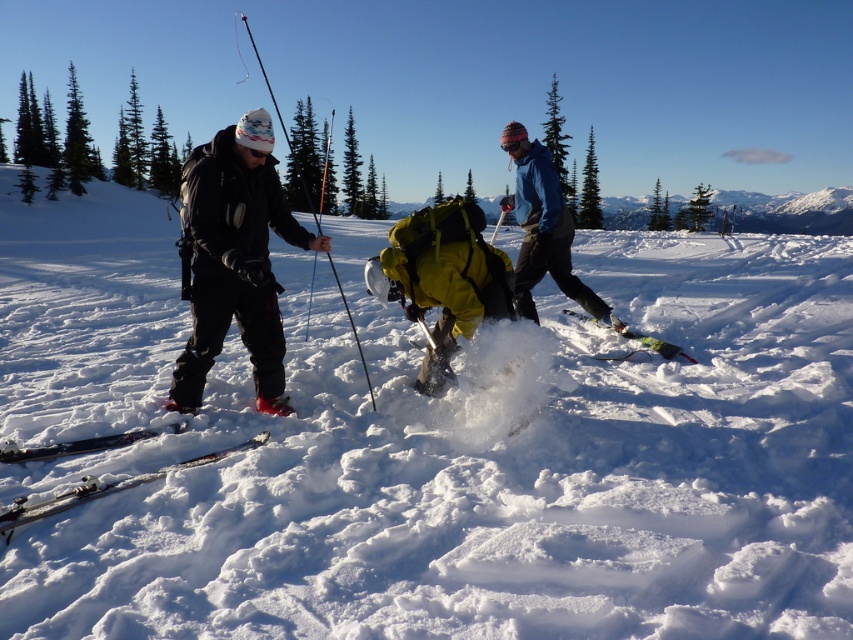
You are a photographer positioned at the camera location. You want to capture a closeup shot of the matte black jacket at left. Given that your camera has a minimum focusing distance of 2 meters, can you take the photo without moving closer?

The matte black jacket at left is 4.45 meters away from the camera. Since the minimum focusing distance is 2 meters, the camera can focus on the matte black jacket at left from that distance, so yes, you can take the photo without moving closer.

You are a photographer trying to capture the scene with a wide angle lens. The blue fleece jacket at center and the shiny black skis at lower left are both in your frame. Which object will appear narrower in your photo?

The blue fleece jacket at center will appear narrower in the photo because it is thinner than the shiny black skis at lower left.

In the winter scene, you see a blue fleece jacket at center and shiny black skis at lower left. Which object is positioned more to the right side of the image?

The blue fleece jacket at center is positioned more to the right side of the image than the shiny black skis at lower left.